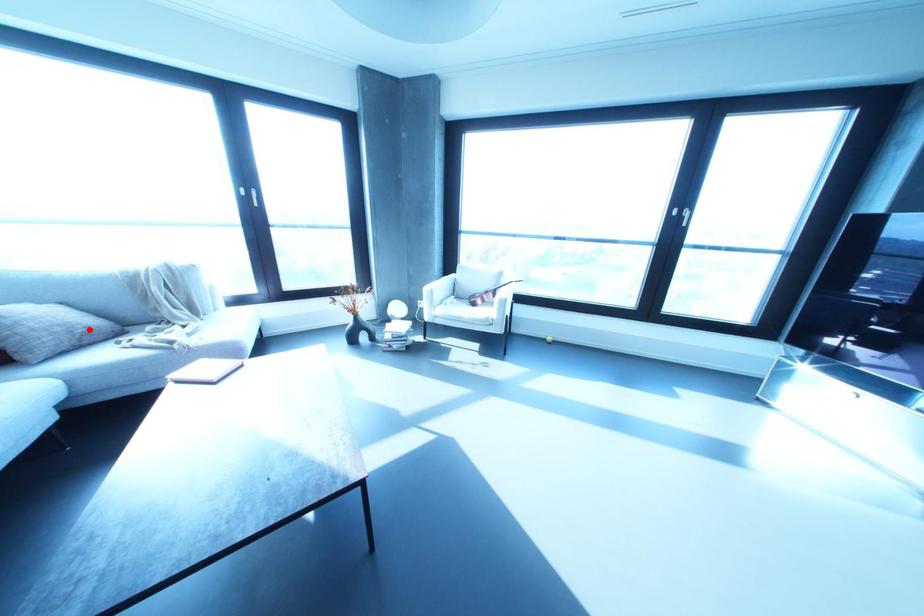
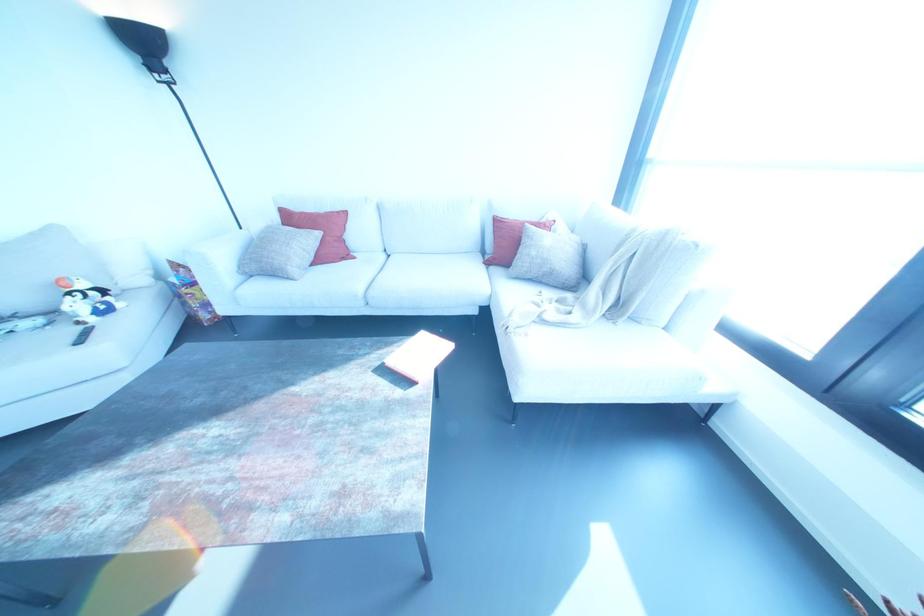
Locate, in the second image, the point that corresponds to the highlighted location in the first image.

(551, 273)